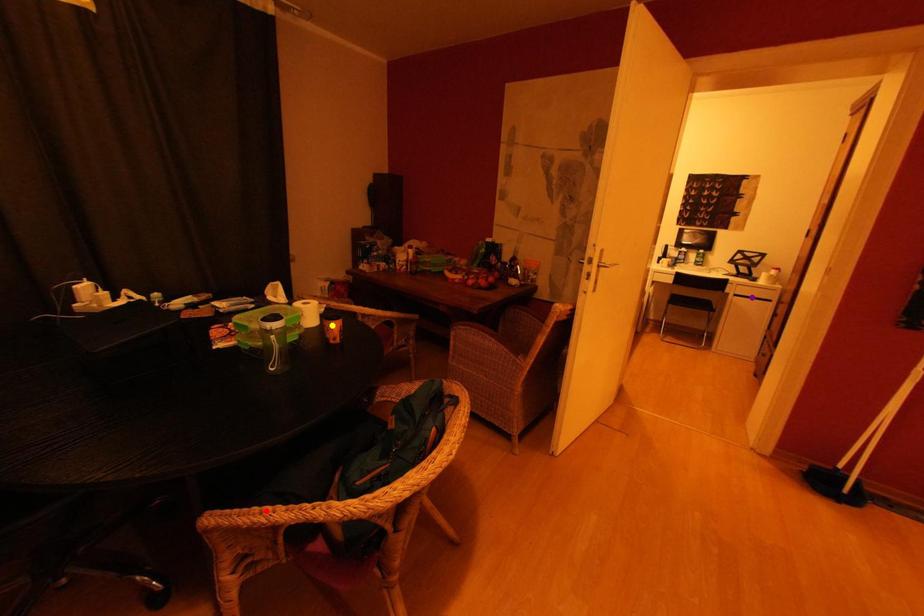
Order these from nearest to farthest:
- red point
- yellow point
- purple point

red point
yellow point
purple point